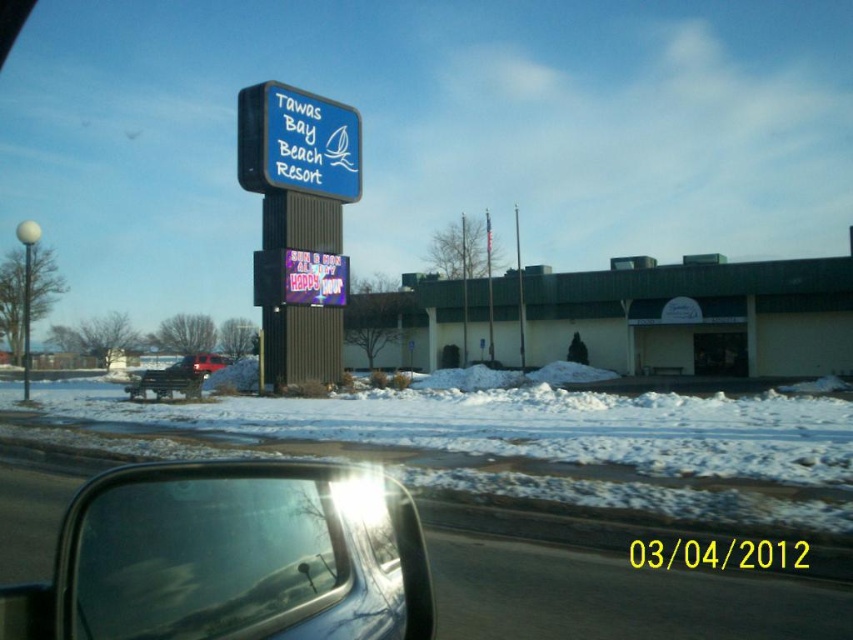
Question: Which object appears farthest from the camera in this image?

Choices:
 (A) transparent glass car window at lower left
 (B) white powdery snow at lower center
 (C) red matte truck at center
 (D) blue plastic sign at upper center

Answer: (D)

Question: Among these points, which one is nearest to the camera?

Choices:
 (A) (675, 432)
 (B) (344, 282)
 (C) (292, 140)
 (D) (136, 593)

Answer: (D)

Question: In this image, where is white powdery snow at lower center located relative to transparent glass car window at lower left?

Choices:
 (A) right
 (B) left

Answer: (B)

Question: Does neon pink digital display at center have a greater width compared to red matte truck at center?

Choices:
 (A) no
 (B) yes

Answer: (A)

Question: Considering the real-world distances, which object is farthest from the neon pink digital display at center?

Choices:
 (A) blue plastic sign at upper center
 (B) white powdery snow at lower center
 (C) transparent glass car window at lower left
 (D) red matte truck at center

Answer: (C)

Question: Can you confirm if neon pink digital display at center is positioned below red matte truck at center?

Choices:
 (A) no
 (B) yes

Answer: (A)